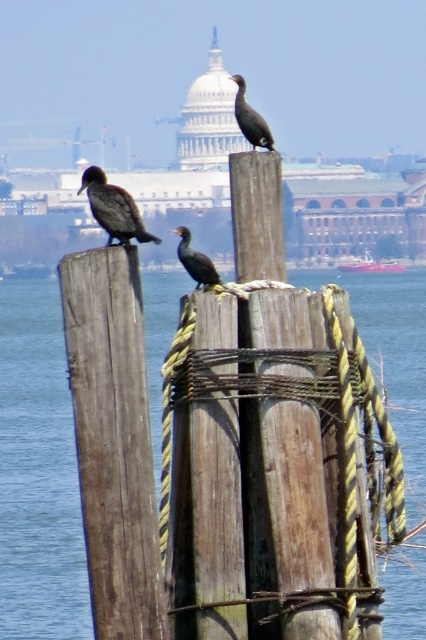
Can you confirm if weathered wood post at center is thinner than orange plastic boat at center?

Yes, weathered wood post at center is thinner than orange plastic boat at center.

Is point (74, 300) closer to viewer compared to point (351, 268)?

Yes, point (74, 300) is closer to viewer.

The height and width of the screenshot is (640, 426). Describe the element at coordinates (114, 440) in the screenshot. I see `weathered wood post at center` at that location.

Locate an element on the screen. The width and height of the screenshot is (426, 640). weathered wood post at center is located at coordinates (114, 440).

Does dark brown feathers at upper center have a lesser height compared to orange plastic boat at center?

No, dark brown feathers at upper center is not shorter than orange plastic boat at center.

Who is higher up, dark brown feathers at upper center or orange plastic boat at center?

Positioned higher is dark brown feathers at upper center.

Between point (244, 113) and point (393, 268), which one is positioned behind?

Positioned behind is point (393, 268).

The width and height of the screenshot is (426, 640). What are the coordinates of `dark brown feathers at upper center` in the screenshot? It's located at (250, 118).

Is transparent water at center to the right of weathered wood post at center from the viewer's perspective?

In fact, transparent water at center is to the left of weathered wood post at center.

Is point (37, 326) less distant than point (95, 442)?

No.

At what (x,y) coordinates should I click in order to perform the action: click on transparent water at center. Please return your answer as a coordinate pair (x, y). The image size is (426, 640). Looking at the image, I should click on (37, 472).